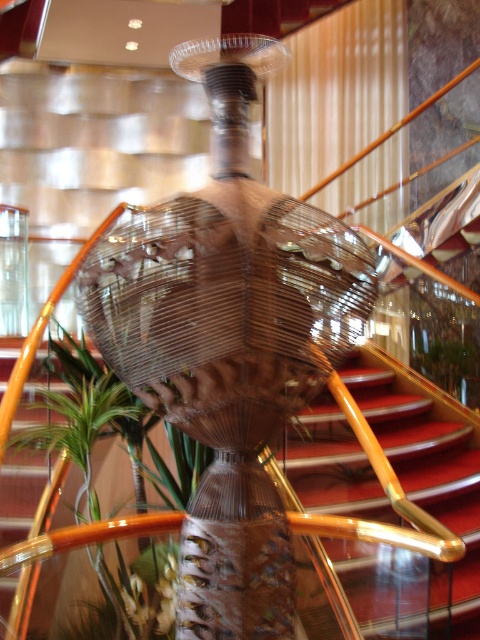
Question: Which object is the farthest from the green leafy plant at center?

Choices:
 (A) brown woven basket at center
 (B) red carpeted stairs at center
 (C) shiny red carpet at center

Answer: (A)

Question: Based on their relative distances, which object is nearer to the red carpeted stairs at center?

Choices:
 (A) green leafy plant at center
 (B) shiny red carpet at center
 (C) brown woven basket at center

Answer: (B)

Question: Among these objects, which one is farthest from the camera?

Choices:
 (A) shiny red carpet at center
 (B) red carpeted stairs at center
 (C) green leafy plant at center

Answer: (A)

Question: From the image, what is the correct spatial relationship of brown woven basket at center in relation to red carpeted stairs at center?

Choices:
 (A) left
 (B) right

Answer: (A)

Question: Is red carpeted stairs at center wider than green leafy plant at center?

Choices:
 (A) no
 (B) yes

Answer: (B)

Question: Observing the image, what is the correct spatial positioning of red carpeted stairs at center in reference to shiny red carpet at center?

Choices:
 (A) right
 (B) left

Answer: (B)